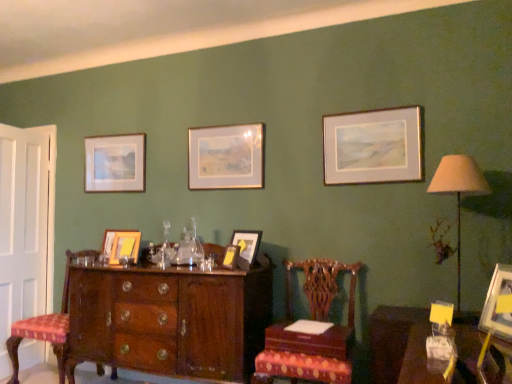
This screenshot has width=512, height=384. What do you see at coordinates (226, 157) in the screenshot?
I see `gold-framed painting at center, the 3th picture frame when ordered from left to right` at bounding box center [226, 157].

The image size is (512, 384). Describe the element at coordinates (458, 192) in the screenshot. I see `beige fabric lampshade at right` at that location.

What is the approximate height of wooden table at lower right?

19.73 inches.

The width and height of the screenshot is (512, 384). What are the coordinates of `wooden picture frame at center, the sixth picture frame in the front-to-back sequence` in the screenshot? It's located at (120, 245).

Can we say wooden picture frame at center, which appears as the 2th picture frame when viewed from the left, lies outside matte silver picture frame at upper left, arranged as the 1th picture frame when viewed from the left?

Yes, wooden picture frame at center, which appears as the 2th picture frame when viewed from the left, is located beyond the bounds of matte silver picture frame at upper left, arranged as the 1th picture frame when viewed from the left.

How many degrees apart are the facing directions of wooden picture frame at center, which appears as the 2th picture frame when viewed from the back, and matte silver picture frame at upper left, arranged as the 1th picture frame when viewed from the left?

There is a 4.16-degree angle between the facing directions of wooden picture frame at center, which appears as the 2th picture frame when viewed from the back, and matte silver picture frame at upper left, arranged as the 1th picture frame when viewed from the left.

In the scene shown: Is wooden picture frame at center, which appears as the 2th picture frame when viewed from the back, next to matte silver picture frame at upper left, positioned as the 1th picture frame in back-to-front order, and touching it?

No, wooden picture frame at center, which appears as the 2th picture frame when viewed from the back, is not beside matte silver picture frame at upper left, positioned as the 1th picture frame in back-to-front order.

Could you tell me if wooden picture frame at center, which appears as the 2th picture frame when viewed from the back, is turned towards matte silver picture frame at upper left, marked as the seventh picture frame in a front-to-back arrangement?

No, wooden picture frame at center, which appears as the 2th picture frame when viewed from the back, is not oriented towards matte silver picture frame at upper left, marked as the seventh picture frame in a front-to-back arrangement.

From the picture: Is wooden picture frame at lower right, which is the first picture frame in front-to-back order, inside or outside of mahogany wooden chest of drawers at center?

wooden picture frame at lower right, which is the first picture frame in front-to-back order, is located beyond the bounds of mahogany wooden chest of drawers at center.

How many degrees apart are the facing directions of wooden picture frame at lower right, which is the 1th picture frame in right-to-left order, and mahogany wooden chest of drawers at center?

There is a 62.4-degree angle between the facing directions of wooden picture frame at lower right, which is the 1th picture frame in right-to-left order, and mahogany wooden chest of drawers at center.

Between wooden picture frame at lower right, which ranks as the seventh picture frame in left-to-right order, and mahogany wooden chest of drawers at center, which one appears on the right side from the viewer's perspective?

wooden picture frame at lower right, which ranks as the seventh picture frame in left-to-right order.

From the image's perspective, between wooden picture frame at lower right, which is the seventh picture frame in back-to-front order, and mahogany wooden chest of drawers at center, who is located below?

mahogany wooden chest of drawers at center appears lower in the image.

Does beige fabric lampshade at right come in front of matte gold picture frame at center, placed as the 4th picture frame when sorted from front to back?

Yes, beige fabric lampshade at right is in front of matte gold picture frame at center, placed as the 4th picture frame when sorted from front to back.

Consider the image. Could you tell me if beige fabric lampshade at right is facing matte gold picture frame at center, the 3th picture frame positioned from the right?

No, beige fabric lampshade at right is not aimed at matte gold picture frame at center, the 3th picture frame positioned from the right.

From the image's perspective, which one is positioned higher, beige fabric lampshade at right or matte gold picture frame at center, the fourth picture frame viewed from the back?

beige fabric lampshade at right.

Considering the relative sizes of beige fabric lampshade at right and matte gold picture frame at center, the 3th picture frame positioned from the right, in the image provided, is beige fabric lampshade at right smaller than matte gold picture frame at center, the 3th picture frame positioned from the right,?

Incorrect, beige fabric lampshade at right is not smaller in size than matte gold picture frame at center, the 3th picture frame positioned from the right.

Is gold metallic picture frame at upper right, the sixth picture frame positioned from the left, to the left of mahogany wooden chest of drawers at center from the viewer's perspective?

No, gold metallic picture frame at upper right, the sixth picture frame positioned from the left, is not to the left of mahogany wooden chest of drawers at center.

Considering the relative sizes of gold metallic picture frame at upper right, the sixth picture frame positioned from the left, and mahogany wooden chest of drawers at center in the image provided, is gold metallic picture frame at upper right, the sixth picture frame positioned from the left, smaller than mahogany wooden chest of drawers at center?

Yes.

Is gold metallic picture frame at upper right, arranged as the 5th picture frame when viewed from the back, directly adjacent to mahogany wooden chest of drawers at center?

No, gold metallic picture frame at upper right, arranged as the 5th picture frame when viewed from the back, is not in contact with mahogany wooden chest of drawers at center.

From a real-world perspective, is gold metallic picture frame at upper right, the third picture frame positioned from the front, beneath mahogany wooden chest of drawers at center?

Actually, gold metallic picture frame at upper right, the third picture frame positioned from the front, is physically above mahogany wooden chest of drawers at center in the real world.

Is white wood door at left at the left side of matte silver picture frame at upper left, which is counted as the 7th picture frame, starting from the right?

Correct, you'll find white wood door at left to the left of matte silver picture frame at upper left, which is counted as the 7th picture frame, starting from the right.

Is white wood door at left thinner than matte silver picture frame at upper left, marked as the seventh picture frame in a front-to-back arrangement?

Incorrect, the width of white wood door at left is not less than that of matte silver picture frame at upper left, marked as the seventh picture frame in a front-to-back arrangement.

Is point (18, 240) positioned after point (92, 161)?

That is False.

Is white wood door at left not inside matte silver picture frame at upper left, positioned as the 1th picture frame in back-to-front order?

Yes, white wood door at left is not within matte silver picture frame at upper left, positioned as the 1th picture frame in back-to-front order.

Looking at this image, is wooden picture frame at lower right, which is the first picture frame in front-to-back order, oriented towards matte silver picture frame at upper left, positioned as the 1th picture frame in back-to-front order?

No, wooden picture frame at lower right, which is the first picture frame in front-to-back order, does not turn towards matte silver picture frame at upper left, positioned as the 1th picture frame in back-to-front order.

Is wooden picture frame at lower right, which ranks as the seventh picture frame in left-to-right order, next to matte silver picture frame at upper left, positioned as the 1th picture frame in back-to-front order, and touching it?

There is a gap between wooden picture frame at lower right, which ranks as the seventh picture frame in left-to-right order, and matte silver picture frame at upper left, positioned as the 1th picture frame in back-to-front order.

Considering the positions of objects wooden picture frame at lower right, which ranks as the seventh picture frame in left-to-right order, and matte silver picture frame at upper left, marked as the seventh picture frame in a front-to-back arrangement, in the image provided, who is in front, wooden picture frame at lower right, which ranks as the seventh picture frame in left-to-right order, or matte silver picture frame at upper left, marked as the seventh picture frame in a front-to-back arrangement,?

wooden picture frame at lower right, which ranks as the seventh picture frame in left-to-right order, is closer to the camera.

This screenshot has height=384, width=512. I want to click on the 6th picture frame in front of the matte silver picture frame at upper left, which is counted as the 7th picture frame, starting from the right, starting your count from the anchor, so click(x=495, y=304).

Can you confirm if matte gold picture frame at center, which is counted as the 4th picture frame, starting from the left, is smaller than wooden table at lower right?

Correct, matte gold picture frame at center, which is counted as the 4th picture frame, starting from the left, occupies less space than wooden table at lower right.

Would you say matte gold picture frame at center, the 6th picture frame from the back, contains wooden table at lower right?

That's incorrect, wooden table at lower right is not inside matte gold picture frame at center, the 6th picture frame from the back.

Does matte gold picture frame at center, the 6th picture frame from the back, turn towards wooden table at lower right?

No.

How distant is matte gold picture frame at center, the 6th picture frame from the back, from wooden table at lower right?

The distance of matte gold picture frame at center, the 6th picture frame from the back, from wooden table at lower right is 1.13 meters.

Find the location of a particular element. the 2nd picture frame located above the wooden picture frame at center, which appears as the 2th picture frame when viewed from the back (from a real-world perspective) is located at coordinates (115, 163).

Identify the location of picture frame that is the 1st one when counting upward from the mahogany wooden chest of drawers at center (from the image's perspective). The height and width of the screenshot is (384, 512). (495, 304).

Based on the photo, looking at the image, which one is located closer to beige fabric lampshade at right, white wood door at left or matte gold picture frame at center, which is the fifth picture frame in left-to-right order?

The object closer to beige fabric lampshade at right is matte gold picture frame at center, which is the fifth picture frame in left-to-right order.

Based on the photo, when comparing their distances from gold metallic picture frame at upper right, placed as the 2th picture frame when sorted from right to left, does beige fabric lampshade at right or matte silver picture frame at upper left, marked as the seventh picture frame in a front-to-back arrangement, seem further?

matte silver picture frame at upper left, marked as the seventh picture frame in a front-to-back arrangement, lies further to gold metallic picture frame at upper right, placed as the 2th picture frame when sorted from right to left, than the other object.

When comparing their distances from wooden chair with upholstered seat at left, which ranks as the 2th chair in front-to-back order, does mahogany wood chair at center, which is counted as the 1th chair, starting from the front, or wooden picture frame at lower right, which is the seventh picture frame in back-to-front order, seem further?

wooden picture frame at lower right, which is the seventh picture frame in back-to-front order, is positioned further to the anchor wooden chair with upholstered seat at left, which ranks as the 2th chair in front-to-back order.

Consider the image. When comparing their distances from wooden picture frame at lower right, which ranks as the seventh picture frame in left-to-right order, does matte gold picture frame at center, which is counted as the 4th picture frame, starting from the left, or wooden table at lower right seem closer?

Among the two, wooden table at lower right is located nearer to wooden picture frame at lower right, which ranks as the seventh picture frame in left-to-right order.

When comparing their distances from matte silver picture frame at upper left, which is counted as the 7th picture frame, starting from the right, does white wood door at left or mahogany wood chair at center, the second chair in the left-to-right sequence, seem closer?

white wood door at left is closer to matte silver picture frame at upper left, which is counted as the 7th picture frame, starting from the right.

Estimate the real-world distances between objects in this image. Which object is closer to matte silver picture frame at upper left, marked as the seventh picture frame in a front-to-back arrangement, gold-framed painting at center, placed as the third picture frame when sorted from back to front, or wooden table at lower right?

gold-framed painting at center, placed as the third picture frame when sorted from back to front, is positioned closer to the anchor matte silver picture frame at upper left, marked as the seventh picture frame in a front-to-back arrangement.

Looking at the image, which one is located closer to white wood door at left, matte gold picture frame at center, the 6th picture frame from the back, or matte silver picture frame at upper left, arranged as the 1th picture frame when viewed from the left?

matte silver picture frame at upper left, arranged as the 1th picture frame when viewed from the left.

Looking at the image, which one is located closer to white wood door at left, wooden picture frame at lower right, which is the seventh picture frame in back-to-front order, or mahogany wood chair at center, placed as the 2th chair when sorted from back to front?

mahogany wood chair at center, placed as the 2th chair when sorted from back to front, lies closer to white wood door at left than the other object.

In order to click on chest of drawers between matte silver picture frame at upper left, arranged as the 1th picture frame when viewed from the left, and wooden chair with upholstered seat at left, which ranks as the 2th chair in front-to-back order, in the vertical direction in this screenshot , I will do `click(170, 320)`.

Locate an element on the screen. Image resolution: width=512 pixels, height=384 pixels. chair located between wooden picture frame at center, which appears as the 2th picture frame when viewed from the back, and beige fabric lampshade at right in the left-right direction is located at coordinates (312, 334).

You are a GUI agent. You are given a task and a screenshot of the screen. Output one action in this format:
    pyautogui.click(x=<x>, y=<y>)
    Task: Click on the chair located between mahogany wooden chest of drawers at center and wooden picture frame at lower right, which is the seventh picture frame in back-to-front order, in the left-right direction
    This screenshot has width=512, height=384.
    Given the screenshot: What is the action you would take?
    pyautogui.click(x=312, y=334)

Where is `the chest of drawers located between white wood door at left and wooden picture frame at lower right, which is the 1th picture frame in right-to-left order, in the left-right direction`? This screenshot has width=512, height=384. the chest of drawers located between white wood door at left and wooden picture frame at lower right, which is the 1th picture frame in right-to-left order, in the left-right direction is located at coordinates (170, 320).